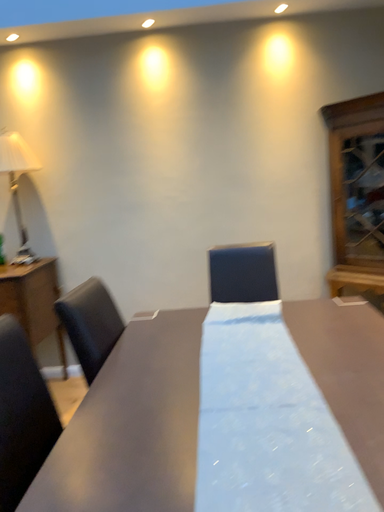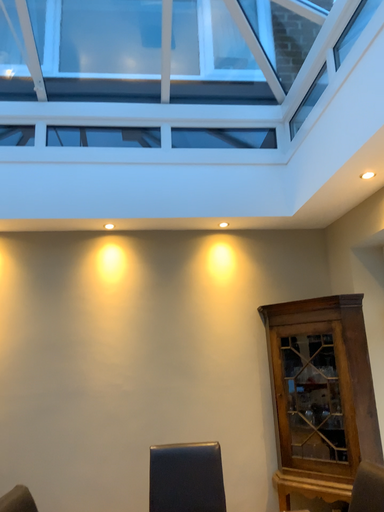
Question: How did the camera likely rotate when shooting the video?

Choices:
 (A) rotated upward
 (B) rotated downward

Answer: (A)